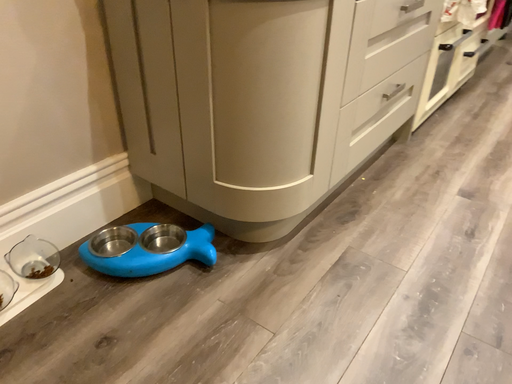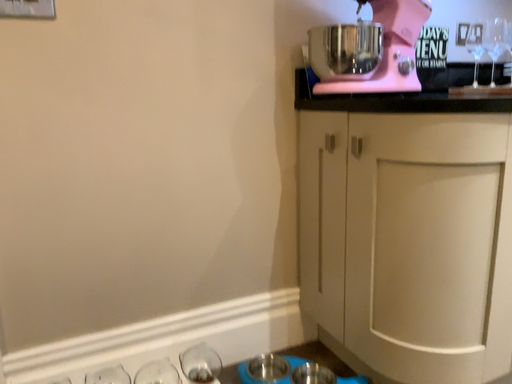
Question: Which way did the camera rotate in the video?

Choices:
 (A) rotated upward
 (B) rotated downward

Answer: (A)